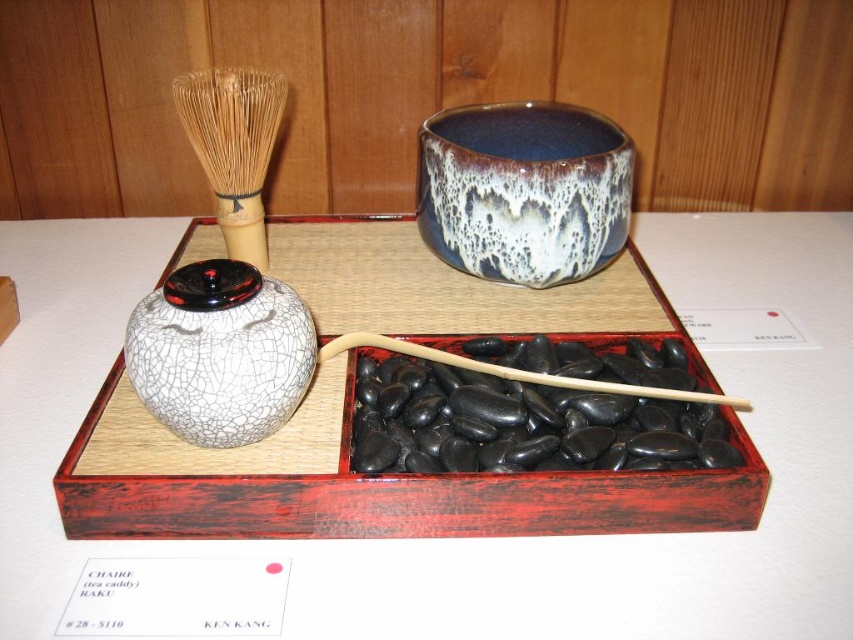
Between speckled ceramic bowl at center and bamboo whisk at upper left, which one is positioned higher?

bamboo whisk at upper left is above.

Identify the location of speckled ceramic bowl at center. Image resolution: width=853 pixels, height=640 pixels. (523, 189).

The width and height of the screenshot is (853, 640). I want to click on speckled ceramic bowl at center, so click(x=523, y=189).

Between bamboo whisk at upper left and wooden stick at center, which one is positioned higher?

bamboo whisk at upper left is above.

At what (x,y) coordinates should I click in order to perform the action: click on bamboo whisk at upper left. Please return your answer as a coordinate pair (x, y). This screenshot has width=853, height=640. Looking at the image, I should click on (233, 147).

Does point (230, 445) lie behind point (453, 358)?

That is False.

Locate an element on the screen. This screenshot has width=853, height=640. cracked ceramic jar at center-left is located at coordinates (219, 353).